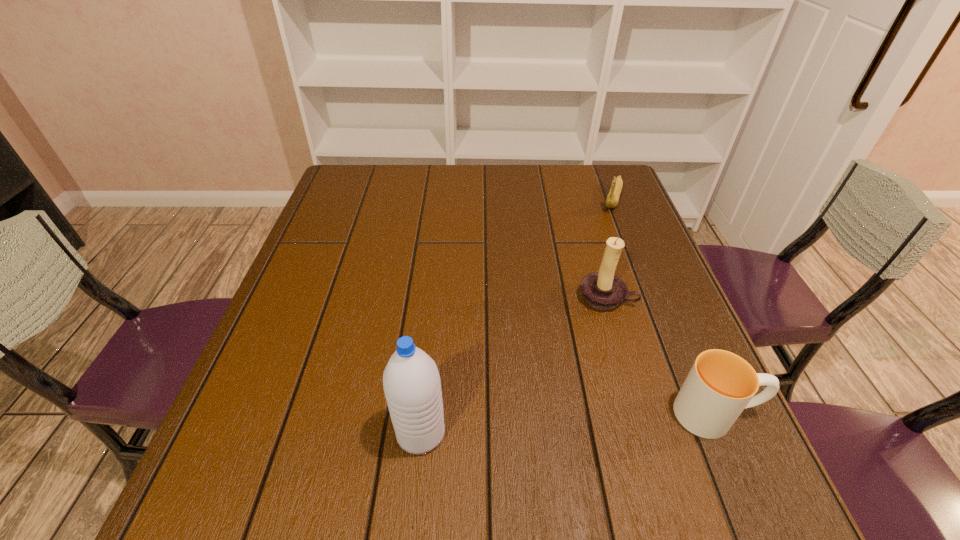
Find the location of a particular element. vacant area that lies between the water bottle and the third shortest object is located at coordinates (514, 365).

Where is `unoccupied position between the second tallest object and the tallest object`? Image resolution: width=960 pixels, height=540 pixels. unoccupied position between the second tallest object and the tallest object is located at coordinates (514, 365).

The height and width of the screenshot is (540, 960). What are the coordinates of `blank region between the cup and the banana` in the screenshot? It's located at (664, 306).

The height and width of the screenshot is (540, 960). In order to click on empty space between the leftmost object and the farthest object in this screenshot , I will do `click(516, 315)`.

Identify the location of vacant region between the water bottle and the banana. (516, 315).

Identify the location of object that is the closest to the third shortest object. (720, 385).

Select which object appears as the closest to the leftmost object. Please provide its 2D coordinates. Your answer should be formatted as a tuple, i.e. [(x, y)], where the tuple contains the x and y coordinates of a point satisfying the conditions above.

[(603, 290)]

This screenshot has height=540, width=960. Find the location of `vacant space that satisfies the following two spatial constraints: 1. on the front side of the cup; 2. with the handle on the side of the candle holder`. vacant space that satisfies the following two spatial constraints: 1. on the front side of the cup; 2. with the handle on the side of the candle holder is located at coordinates (640, 414).

Where is `free spot that satisfies the following two spatial constraints: 1. on the back side of the third nearest object; 2. on the right side of the farthest object`? The image size is (960, 540). free spot that satisfies the following two spatial constraints: 1. on the back side of the third nearest object; 2. on the right side of the farthest object is located at coordinates (577, 198).

At what (x,y) coordinates should I click in order to perform the action: click on free spot that satisfies the following two spatial constraints: 1. on the back side of the candle holder; 2. on the right side of the leftmost object. Please return your answer as a coordinate pair (x, y). Image resolution: width=960 pixels, height=540 pixels. Looking at the image, I should click on (435, 298).